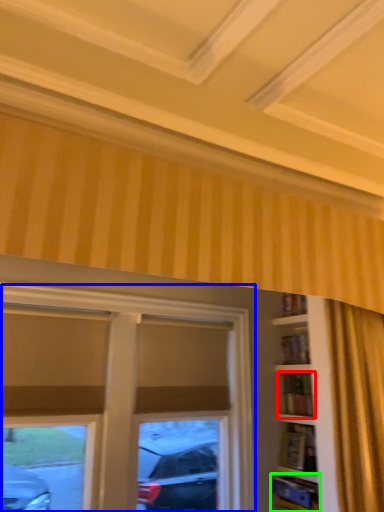
Question: Based on their relative distances, which object is farther from shelf (highlighted by a red box)? Choose from window (highlighted by a blue box) and shelf (highlighted by a green box).

Choices:
 (A) window
 (B) shelf

Answer: (A)